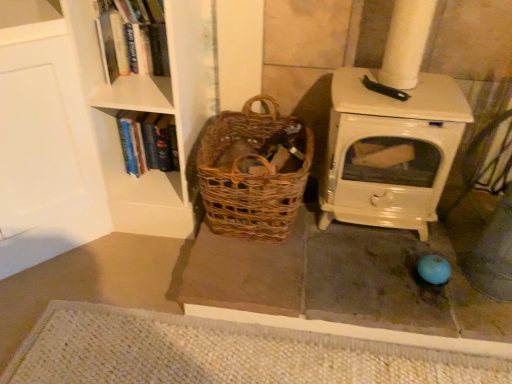
Locate an element on the screen. This screenshot has height=384, width=512. white woven mat at lower center is located at coordinates (220, 353).

Measure the distance between woven brown basket at center and camera.

A distance of 1.42 meters exists between woven brown basket at center and camera.

Where is `white woven mat at lower center`? white woven mat at lower center is located at coordinates (220, 353).

From a real-world perspective, is hardcover book at upper left, the 2th book positioned from the bottom, positioned over woven brown basket at center based on gravity?

Yes, from a real-world perspective, hardcover book at upper left, the 2th book positioned from the bottom, is over woven brown basket at center

Does hardcover book at upper left, the 2th book positioned from the bottom, appear on the left side of woven brown basket at center?

Yes, hardcover book at upper left, the 2th book positioned from the bottom, is to the left of woven brown basket at center.

Considering the relative sizes of hardcover book at upper left, the 2th book positioned from the bottom, and woven brown basket at center in the image provided, is hardcover book at upper left, the 2th book positioned from the bottom, bigger than woven brown basket at center?

No.

Is hardcover book at upper left, which is the 2th book in back-to-front order, further to the viewer compared to woven brown basket at center?

Yes, it is.

Is woven brown basket at center positioned beyond the bounds of hardcover book at upper left, which ranks as the 1th book in top-to-bottom order?

That's correct, woven brown basket at center is outside of hardcover book at upper left, which ranks as the 1th book in top-to-bottom order.

Find the location of a particular element. This screenshot has height=384, width=512. the 1st book behind the woven brown basket at center is located at coordinates (132, 37).

From a real-world perspective, is woven brown basket at center physically located above or below hardcover book at upper left, which is the 2th book in back-to-front order?

Clearly, from a real-world perspective, woven brown basket at center is below hardcover book at upper left, which is the 2th book in back-to-front order.

Considering the relative sizes of woven brown basket at center and hardcover book at upper left, which ranks as the 1th book in top-to-bottom order, in the image provided, is woven brown basket at center taller than hardcover book at upper left, which ranks as the 1th book in top-to-bottom order,?

Indeed, woven brown basket at center has a greater height compared to hardcover book at upper left, which ranks as the 1th book in top-to-bottom order.

Is hardcover book at left, the 2th book from the top, in front of or behind hardcover book at upper left, which ranks as the 1th book in top-to-bottom order, in the image?

Clearly, hardcover book at left, the 2th book from the top, is behind hardcover book at upper left, which ranks as the 1th book in top-to-bottom order.

Which object is positioned more to the right, hardcover book at left, placed as the first book when sorted from back to front, or hardcover book at upper left, the first book when ordered from front to back?

From the viewer's perspective, hardcover book at upper left, the first book when ordered from front to back, appears more on the right side.

From a real-world perspective, is hardcover book at left, placed as the first book when sorted from back to front, beneath hardcover book at upper left, the first book when ordered from front to back?

Yes, from a real-world perspective, hardcover book at left, placed as the first book when sorted from back to front, is beneath hardcover book at upper left, the first book when ordered from front to back.

Image resolution: width=512 pixels, height=384 pixels. Identify the location of the 1st book behind the white woven mat at lower center, counting from the anchor's position. [132, 37].

Considering their positions, is white woven mat at lower center located in front of or behind hardcover book at upper left, the first book when ordered from front to back?

white woven mat at lower center is positioned closer to the viewer than hardcover book at upper left, the first book when ordered from front to back.

Is white woven mat at lower center to the right of hardcover book at upper left, the first book when ordered from front to back, from the viewer's perspective?

Yes, white woven mat at lower center is to the right of hardcover book at upper left, the first book when ordered from front to back.

Is white woven mat at lower center thinner than hardcover book at upper left, which is the 2th book in back-to-front order?

No.

From the picture: Is hardcover book at left, the 2th book from the top, positioned far away from woven brown basket at center?

No, there isn't a large distance between hardcover book at left, the 2th book from the top, and woven brown basket at center.

Is point (159, 159) positioned behind point (208, 210)?

That is True.

Is hardcover book at left, which is the first book in bottom-to-top order, inside or outside of woven brown basket at center?

hardcover book at left, which is the first book in bottom-to-top order, is not inside woven brown basket at center, it's outside.

Who is smaller, hardcover book at left, which is the first book in bottom-to-top order, or woven brown basket at center?

hardcover book at left, which is the first book in bottom-to-top order, is smaller.

From the image's perspective, is hardcover book at upper left, the 2th book positioned from the bottom, positioned above or below white woven mat at lower center?

From the image's perspective, hardcover book at upper left, the 2th book positioned from the bottom, appears above white woven mat at lower center.

Identify the location of the 2nd book directly above the white woven mat at lower center (from a real-world perspective). The width and height of the screenshot is (512, 384). (132, 37).

Can you tell me how much hardcover book at upper left, the first book when ordered from front to back, and white woven mat at lower center differ in facing direction?

The angular difference between hardcover book at upper left, the first book when ordered from front to back, and white woven mat at lower center is 90.5 degrees.

Considering the points (136, 19) and (136, 315), which point is behind, point (136, 19) or point (136, 315)?

Positioned behind is point (136, 19).

Does hardcover book at upper left, which is the 2th book in back-to-front order, turn towards hardcover book at left, which is the first book in bottom-to-top order?

No, hardcover book at upper left, which is the 2th book in back-to-front order, is not oriented towards hardcover book at left, which is the first book in bottom-to-top order.

Can you confirm if hardcover book at upper left, the 2th book positioned from the bottom, is wider than hardcover book at left, the 2th book from the top?

In fact, hardcover book at upper left, the 2th book positioned from the bottom, might be narrower than hardcover book at left, the 2th book from the top.

In the image, there is a hardcover book at upper left, which is the 2th book in back-to-front order. Identify the location of book below it (from a real-world perspective). This screenshot has width=512, height=384. (147, 141).

From the image's perspective, between hardcover book at upper left, the first book when ordered from front to back, and hardcover book at left, placed as the second book when sorted from front to back, which one is located above?

hardcover book at upper left, the first book when ordered from front to back, appears higher in the image.

Image resolution: width=512 pixels, height=384 pixels. I want to click on book above the woven brown basket at center (from a real-world perspective), so (x=132, y=37).

This screenshot has height=384, width=512. I want to click on the 1st book counting from the left side of the woven brown basket at center, so click(132, 37).

Based on their spatial positions, is woven brown basket at center or white woven mat at lower center closer to hardcover book at left, placed as the first book when sorted from back to front?

woven brown basket at center.

Considering their positions, is hardcover book at upper left, the first book when ordered from front to back, positioned closer to white woven mat at lower center than hardcover book at left, the 2th book from the top?

The object closer to white woven mat at lower center is hardcover book at left, the 2th book from the top.

Based on their spatial positions, is woven brown basket at center or white woven mat at lower center closer to hardcover book at upper left, which ranks as the 1th book in top-to-bottom order?

woven brown basket at center.

Estimate the real-world distances between objects in this image. Which object is further from white woven mat at lower center, woven brown basket at center or hardcover book at upper left, the 2th book positioned from the bottom?

The object further to white woven mat at lower center is hardcover book at upper left, the 2th book positioned from the bottom.

From the image, which object appears to be farther from hardcover book at upper left, the 2th book positioned from the bottom, woven brown basket at center or hardcover book at left, which is the first book in bottom-to-top order?

woven brown basket at center lies further to hardcover book at upper left, the 2th book positioned from the bottom, than the other object.

Considering their positions, is hardcover book at left, the 2th book from the top, positioned closer to woven brown basket at center than white woven mat at lower center?

hardcover book at left, the 2th book from the top, is closer to woven brown basket at center.

When comparing their distances from white woven mat at lower center, does woven brown basket at center or hardcover book at left, placed as the first book when sorted from back to front, seem further?

Among the two, hardcover book at left, placed as the first book when sorted from back to front, is located further to white woven mat at lower center.

Considering their positions, is hardcover book at left, the 2th book from the top, positioned further to hardcover book at upper left, which ranks as the 1th book in top-to-bottom order, than white woven mat at lower center?

white woven mat at lower center lies further to hardcover book at upper left, which ranks as the 1th book in top-to-bottom order, than the other object.

Where is `book between hardcover book at upper left, which is the 2th book in back-to-front order, and white woven mat at lower center from top to bottom`? book between hardcover book at upper left, which is the 2th book in back-to-front order, and white woven mat at lower center from top to bottom is located at coordinates (147, 141).

Locate an element on the screen. This screenshot has width=512, height=384. basket between hardcover book at left, which is the first book in bottom-to-top order, and white woven mat at lower center vertically is located at coordinates (251, 174).

What are the coordinates of `book situated between hardcover book at left, placed as the first book when sorted from back to front, and woven brown basket at center from left to right` in the screenshot? It's located at (132, 37).

Locate an element on the screen. basket that lies between hardcover book at upper left, which ranks as the 1th book in top-to-bottom order, and white woven mat at lower center from top to bottom is located at coordinates 251,174.